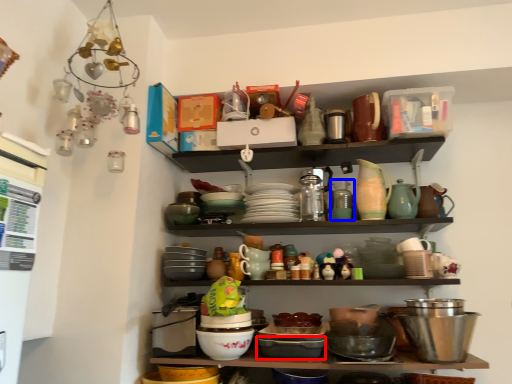
Question: Which object is further to the camera taking this photo, bowl (highlighted by a red box) or tableware (highlighted by a blue box)?

Choices:
 (A) bowl
 (B) tableware

Answer: (B)